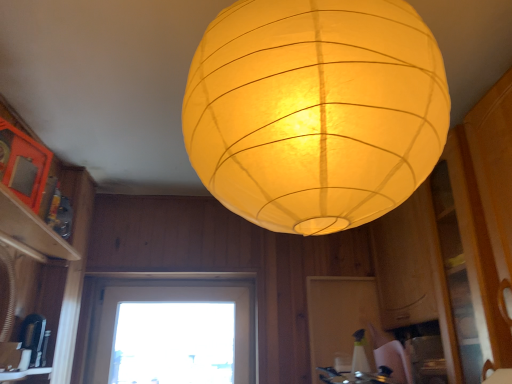
In order to face matte wood shelf at upper left, should I rotate leftwards or rightwards?

To face it directly, rotate left by 29.000 degrees.

At what (x,y) coordinates should I click in order to perform the action: click on matte wood shelf at upper left. Please return your answer as a coordinate pair (x, y). The image size is (512, 384). Looking at the image, I should click on (31, 228).

Where is `transparent glass window at center`? transparent glass window at center is located at coordinates (172, 332).

You are a GUI agent. You are given a task and a screenshot of the screen. Output one action in this format:
    pyautogui.click(x=<x>, y=<y>)
    Task: Click on the black plastic coffee maker at lower left
    This screenshot has width=512, height=384.
    Given the screenshot: What is the action you would take?
    click(x=35, y=339)

Considering the sizes of objects metallic silver gas stove at lower center and matte yellow paper lantern at center in the image provided, who is bigger, metallic silver gas stove at lower center or matte yellow paper lantern at center?

With larger size is matte yellow paper lantern at center.

From the image's perspective, is metallic silver gas stove at lower center beneath matte yellow paper lantern at center?

Yes.

Is metallic silver gas stove at lower center wider than matte yellow paper lantern at center?

Incorrect, the width of metallic silver gas stove at lower center does not surpass that of matte yellow paper lantern at center.

Is metallic silver gas stove at lower center far away from matte yellow paper lantern at center?

metallic silver gas stove at lower center is far away from matte yellow paper lantern at center.

From a real-world perspective, is transparent glass window at center under metallic silver gas stove at lower center?

No, from a real-world perspective, transparent glass window at center is not below metallic silver gas stove at lower center.

Which is more to the right, transparent glass window at center or metallic silver gas stove at lower center?

metallic silver gas stove at lower center.

I want to click on gas stove directly beneath the transparent glass window at center (from a real-world perspective), so click(357, 376).

Is transparent glass window at center situated inside metallic silver gas stove at lower center or outside?

transparent glass window at center is not inside metallic silver gas stove at lower center, it's outside.

Considering the points (42, 365) and (5, 211), which point is behind, point (42, 365) or point (5, 211)?

The point (42, 365) is farther from the camera.

Can you confirm if black plastic coffee maker at lower left is smaller than matte wood shelf at upper left?

Correct, black plastic coffee maker at lower left occupies less space than matte wood shelf at upper left.

Is black plastic coffee maker at lower left turned away from matte wood shelf at upper left?

That's not correct — black plastic coffee maker at lower left is not looking away from matte wood shelf at upper left.

Is the depth of black plastic coffee maker at lower left greater than that of matte wood shelf at upper left?

Yes, black plastic coffee maker at lower left is further from the viewer.

Considering the relative sizes of matte wood shelf at upper left and matte yellow paper lantern at center in the image provided, is matte wood shelf at upper left bigger than matte yellow paper lantern at center?

Actually, matte wood shelf at upper left might be smaller than matte yellow paper lantern at center.

From the image's perspective, is matte wood shelf at upper left over matte yellow paper lantern at center?

No, from the image's perspective, matte wood shelf at upper left is not over matte yellow paper lantern at center.

Is point (29, 217) closer or farther from the camera than point (325, 165)?

Point (29, 217) is farther from the camera than point (325, 165).

Which object is further away from the camera taking this photo, matte wood shelf at upper left or matte yellow paper lantern at center?

matte wood shelf at upper left is behind.

Considering the relative sizes of black plastic coffee maker at lower left and transparent glass window at center in the image provided, is black plastic coffee maker at lower left shorter than transparent glass window at center?

Correct, black plastic coffee maker at lower left is not as tall as transparent glass window at center.

Which object is positioned more to the right, black plastic coffee maker at lower left or transparent glass window at center?

From the viewer's perspective, transparent glass window at center appears more on the right side.

This screenshot has width=512, height=384. In order to click on appliance lying above the transparent glass window at center (from the image's perspective) in this screenshot , I will do `click(35, 339)`.

Is black plastic coffee maker at lower left far from transparent glass window at center?

No, there isn't a large distance between black plastic coffee maker at lower left and transparent glass window at center.

From a real-world perspective, which is physically above, matte yellow paper lantern at center or black plastic coffee maker at lower left?

matte yellow paper lantern at center, from a real-world perspective.

Based on the photo, in the image, is matte yellow paper lantern at center positioned in front of or behind black plastic coffee maker at lower left?

matte yellow paper lantern at center is positioned closer to the viewer than black plastic coffee maker at lower left.

Considering the relative sizes of matte yellow paper lantern at center and black plastic coffee maker at lower left in the image provided, is matte yellow paper lantern at center wider than black plastic coffee maker at lower left?

Yes.

Does point (343, 110) lie in front of point (29, 336)?

Yes.

Can you confirm if matte yellow paper lantern at center is taller than metallic silver gas stove at lower center?

Indeed, matte yellow paper lantern at center has a greater height compared to metallic silver gas stove at lower center.

Looking at this image, is matte yellow paper lantern at center beside metallic silver gas stove at lower center?

No, matte yellow paper lantern at center is not with metallic silver gas stove at lower center.

Is point (234, 138) farther from viewer compared to point (382, 375)?

No, it is in front of (382, 375).

This screenshot has width=512, height=384. I want to click on gas stove below the matte yellow paper lantern at center (from the image's perspective), so click(357, 376).

Where is `gas stove on the right of transparent glass window at center`? Image resolution: width=512 pixels, height=384 pixels. gas stove on the right of transparent glass window at center is located at coordinates (357, 376).

Which object lies further to the anchor point black plastic coffee maker at lower left, metallic silver gas stove at lower center or matte yellow paper lantern at center?

matte yellow paper lantern at center is further to black plastic coffee maker at lower left.

Estimate the real-world distances between objects in this image. Which object is further from transparent glass window at center, black plastic coffee maker at lower left or matte wood shelf at upper left?

matte wood shelf at upper left lies further to transparent glass window at center than the other object.

From the image, which object appears to be nearer to matte wood shelf at upper left, matte yellow paper lantern at center or metallic silver gas stove at lower center?

Based on the image, matte yellow paper lantern at center appears to be nearer to matte wood shelf at upper left.

Consider the image. Considering their positions, is matte wood shelf at upper left positioned further to matte yellow paper lantern at center than transparent glass window at center?

transparent glass window at center is positioned further to the anchor matte yellow paper lantern at center.

Estimate the real-world distances between objects in this image. Which object is further from matte wood shelf at upper left, transparent glass window at center or black plastic coffee maker at lower left?

Among the two, transparent glass window at center is located further to matte wood shelf at upper left.

Based on their spatial positions, is black plastic coffee maker at lower left or transparent glass window at center closer to metallic silver gas stove at lower center?

transparent glass window at center is closer to metallic silver gas stove at lower center.

Estimate the real-world distances between objects in this image. Which object is further from matte yellow paper lantern at center, black plastic coffee maker at lower left or transparent glass window at center?

Among the two, transparent glass window at center is located further to matte yellow paper lantern at center.

Considering their positions, is transparent glass window at center positioned closer to matte wood shelf at upper left than matte yellow paper lantern at center?

transparent glass window at center is positioned closer to the anchor matte wood shelf at upper left.

Find the location of a particular element. The width and height of the screenshot is (512, 384). window between matte wood shelf at upper left and metallic silver gas stove at lower center in the horizontal direction is located at coordinates (172, 332).

Find the location of a particular element. Image resolution: width=512 pixels, height=384 pixels. appliance between matte yellow paper lantern at center and transparent glass window at center in the front-back direction is located at coordinates (35, 339).

Where is `lantern between matte wood shelf at upper left and metallic silver gas stove at lower center`? The image size is (512, 384). lantern between matte wood shelf at upper left and metallic silver gas stove at lower center is located at coordinates (315, 111).

You are a GUI agent. You are given a task and a screenshot of the screen. Output one action in this format:
    pyautogui.click(x=<x>, y=<y>)
    Task: Click on the shelf positioned between matte yellow paper lantern at center and black plastic coffee maker at lower left from near to far
    This screenshot has height=384, width=512.
    Given the screenshot: What is the action you would take?
    pyautogui.click(x=31, y=228)